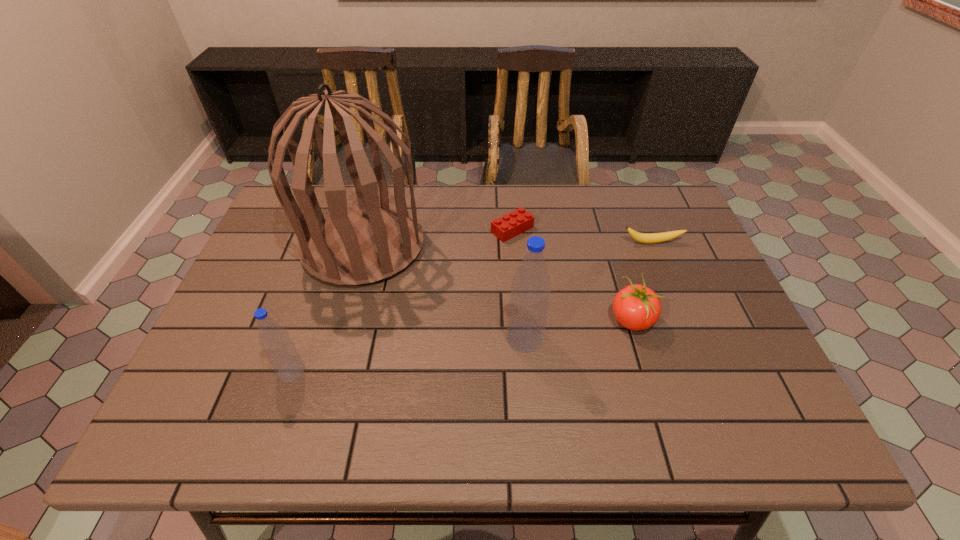
Locate an element on the screen. vacant region between the banana and the nearer water bottle is located at coordinates (471, 307).

You are a GUI agent. You are given a task and a screenshot of the screen. Output one action in this format:
    pyautogui.click(x=<x>, y=<y>)
    Task: Click on the blank region between the taller water bottle and the tomato
    This screenshot has height=540, width=960.
    Given the screenshot: What is the action you would take?
    pyautogui.click(x=578, y=329)

I want to click on object identified as the third closest to the right water bottle, so click(510, 225).

Locate an element on the screen. The image size is (960, 540). the fifth closest object to the farther water bottle is located at coordinates (280, 350).

This screenshot has width=960, height=540. Identify the location of vacant region that satisfies the following two spatial constraints: 1. on the back side of the Lego; 2. on the right side of the left water bottle. (340, 230).

At what (x,y) coordinates should I click in order to perform the action: click on free spot that satisfies the following two spatial constraints: 1. on the back side of the birdcage; 2. on the left side of the shortest object. Please return your answer as a coordinate pair (x, y). Image resolution: width=960 pixels, height=540 pixels. Looking at the image, I should click on (368, 230).